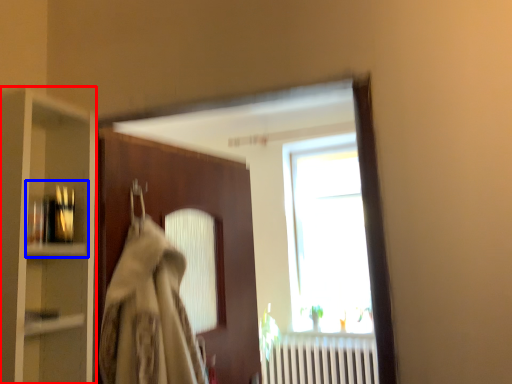
Question: Which object appears closest to the camera in this image, cabinetry (highlighted by a red box) or shelf (highlighted by a blue box)?

Choices:
 (A) cabinetry
 (B) shelf

Answer: (A)